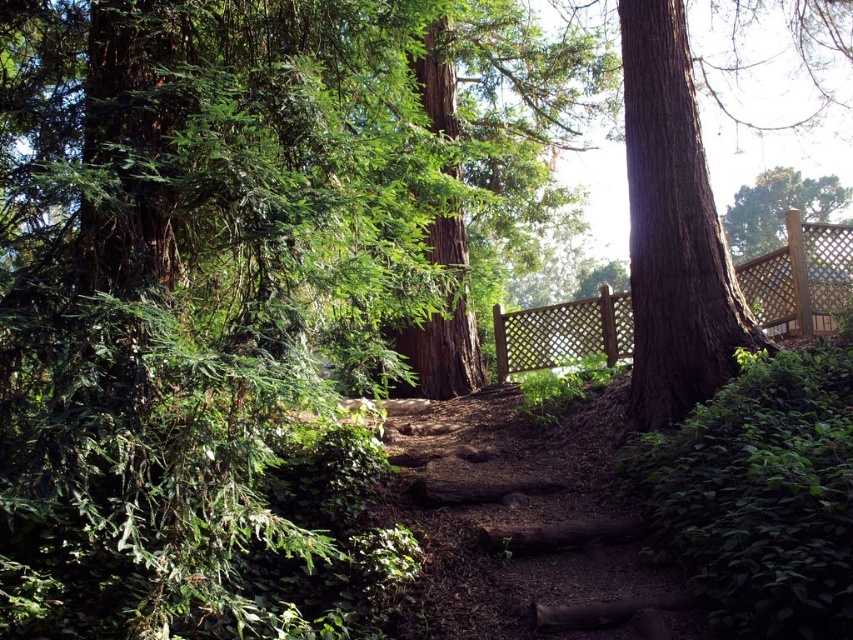
Does smooth brown tree trunk at right have a greater width compared to wooden lattice fence at right?

No, smooth brown tree trunk at right is not wider than wooden lattice fence at right.

Where is `smooth brown tree trunk at right`? The height and width of the screenshot is (640, 853). smooth brown tree trunk at right is located at coordinates (672, 228).